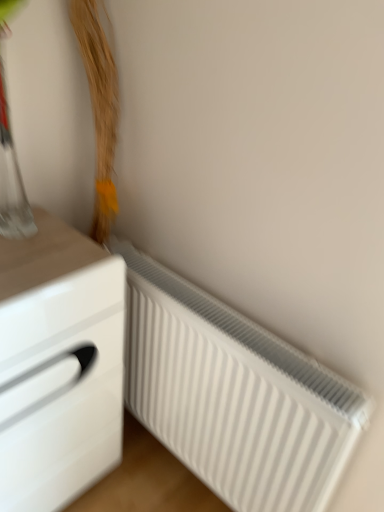
Question: Considering the relative sizes of white ribbed radiator at lower right and white glossy chest of drawers at left in the image provided, is white ribbed radiator at lower right smaller than white glossy chest of drawers at left?

Choices:
 (A) yes
 (B) no

Answer: (A)

Question: Considering the relative sizes of white ribbed radiator at lower right and white glossy chest of drawers at left in the image provided, is white ribbed radiator at lower right shorter than white glossy chest of drawers at left?

Choices:
 (A) yes
 (B) no

Answer: (A)

Question: Does white ribbed radiator at lower right turn towards white glossy chest of drawers at left?

Choices:
 (A) yes
 (B) no

Answer: (A)

Question: From the image's perspective, is white ribbed radiator at lower right located above white glossy chest of drawers at left?

Choices:
 (A) no
 (B) yes

Answer: (A)

Question: Can white glossy chest of drawers at left be found inside white ribbed radiator at lower right?

Choices:
 (A) no
 (B) yes

Answer: (A)

Question: Is white ribbed radiator at lower right taller than white glossy chest of drawers at left?

Choices:
 (A) no
 (B) yes

Answer: (A)

Question: Is white glossy chest of drawers at left at the right side of white ribbed radiator at lower right?

Choices:
 (A) no
 (B) yes

Answer: (A)

Question: Is white glossy chest of drawers at left outside white ribbed radiator at lower right?

Choices:
 (A) yes
 (B) no

Answer: (A)

Question: Is white glossy chest of drawers at left facing towards white ribbed radiator at lower right?

Choices:
 (A) no
 (B) yes

Answer: (A)

Question: Does white glossy chest of drawers at left appear on the left side of white ribbed radiator at lower right?

Choices:
 (A) no
 (B) yes

Answer: (B)

Question: Does white glossy chest of drawers at left have a greater width compared to white ribbed radiator at lower right?

Choices:
 (A) no
 (B) yes

Answer: (B)

Question: From the image's perspective, does white glossy chest of drawers at left appear lower than white ribbed radiator at lower right?

Choices:
 (A) no
 (B) yes

Answer: (A)

Question: Considering the positions of white ribbed radiator at lower right and white glossy chest of drawers at left in the image, is white ribbed radiator at lower right taller or shorter than white glossy chest of drawers at left?

Choices:
 (A) short
 (B) tall

Answer: (A)